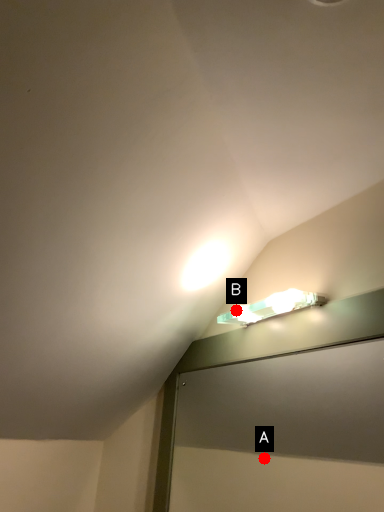
Question: Two points are circled on the image, labeled by A and B beside each circle. Which point is farther to the camera?

Choices:
 (A) A is further
 (B) B is further

Answer: (A)